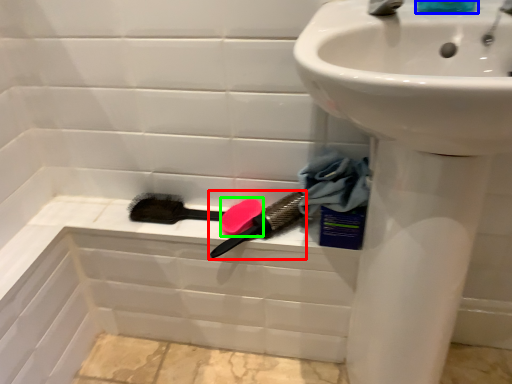
Question: Which is farther away from brush (highlighted by a red box)? liquid (highlighted by a blue box) or soap (highlighted by a green box)?

Choices:
 (A) liquid
 (B) soap

Answer: (A)